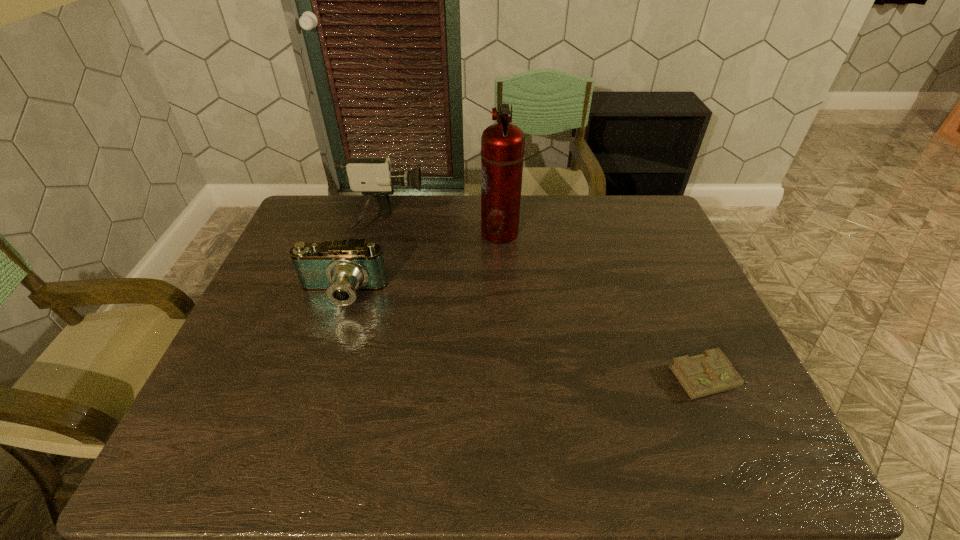
I want to click on free space between the rightmost object and the third shortest object, so click(546, 301).

In order to click on free space between the nearer camcorder and the fire extinguisher in this screenshot , I will do `click(420, 264)`.

Find the location of `free spot between the second object from right to left and the shorter camcorder`. free spot between the second object from right to left and the shorter camcorder is located at coordinates (420, 264).

Identify which object is the third closest to the shortest object. Please provide its 2D coordinates. Your answer should be formatted as a tuple, i.e. [(x, y)], where the tuple contains the x and y coordinates of a point satisfying the conditions above.

[(373, 177)]

Identify which object is the second closest to the shorter camcorder. Please provide its 2D coordinates. Your answer should be formatted as a tuple, i.e. [(x, y)], where the tuple contains the x and y coordinates of a point satisfying the conditions above.

[(502, 144)]

Locate an element on the screen. This screenshot has height=540, width=960. vacant space that satisfies the following two spatial constraints: 1. on the nozzle side of the nearest object; 2. on the left side of the fire extinguisher is located at coordinates [x=508, y=378].

Locate an element on the screen. vacant region that satisfies the following two spatial constraints: 1. on the recording direction of the diary; 2. on the left side of the third shortest object is located at coordinates (342, 378).

You are a GUI agent. You are given a task and a screenshot of the screen. Output one action in this format:
    pyautogui.click(x=<x>, y=<y>)
    Task: Click on the vacant region that satisfies the following two spatial constraints: 1. on the recording direction of the diary; 2. on the left side of the taller camcorder
    This screenshot has height=540, width=960.
    Given the screenshot: What is the action you would take?
    pyautogui.click(x=342, y=378)

Identify the location of free location that satisfies the following two spatial constraints: 1. on the nozzle side of the fire extinguisher; 2. on the front-facing side of the third tallest object. (503, 294).

In order to click on free spot that satisfies the following two spatial constraints: 1. on the front-facing side of the third farthest object; 2. on the right side of the diary in this screenshot , I will do `click(315, 378)`.